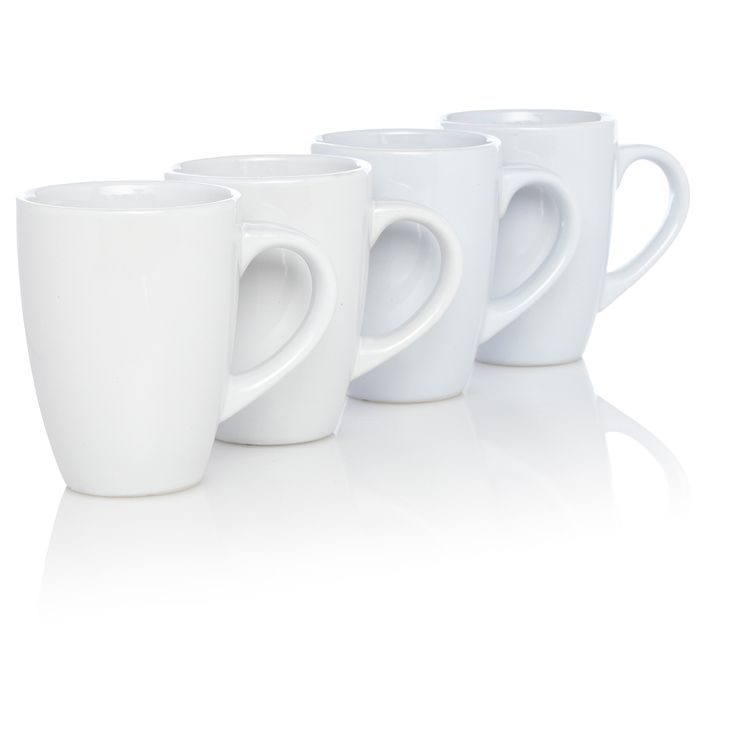
The width and height of the screenshot is (736, 736). I want to click on mugs, so click(x=160, y=305), click(x=302, y=208), click(x=420, y=187), click(x=552, y=163).